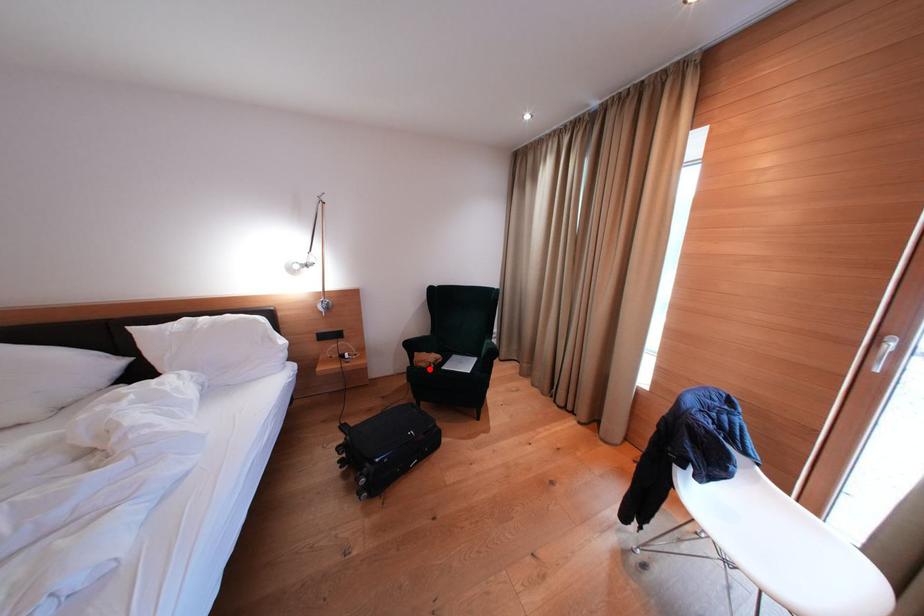
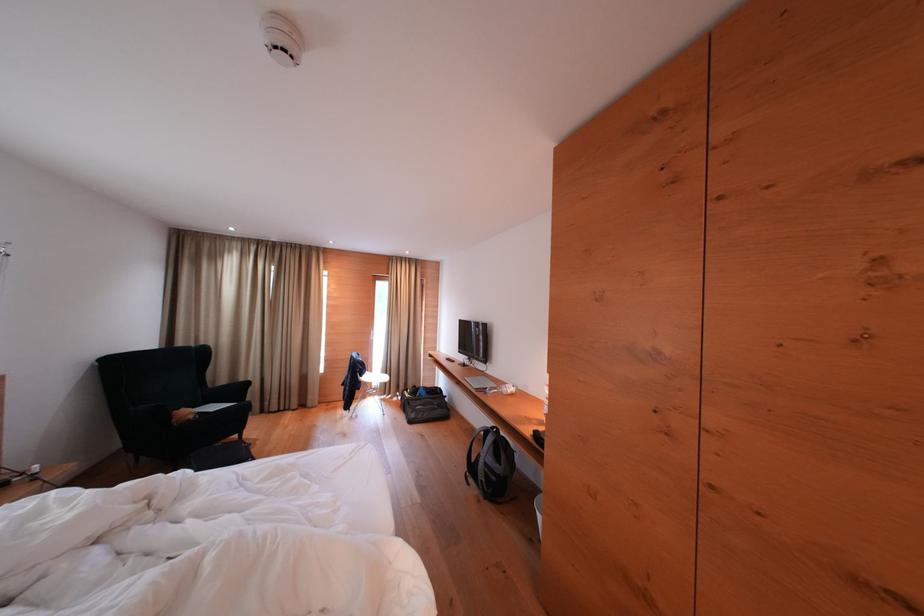
Find the pixel in the second image that matches the highlighted location in the first image.

(198, 421)